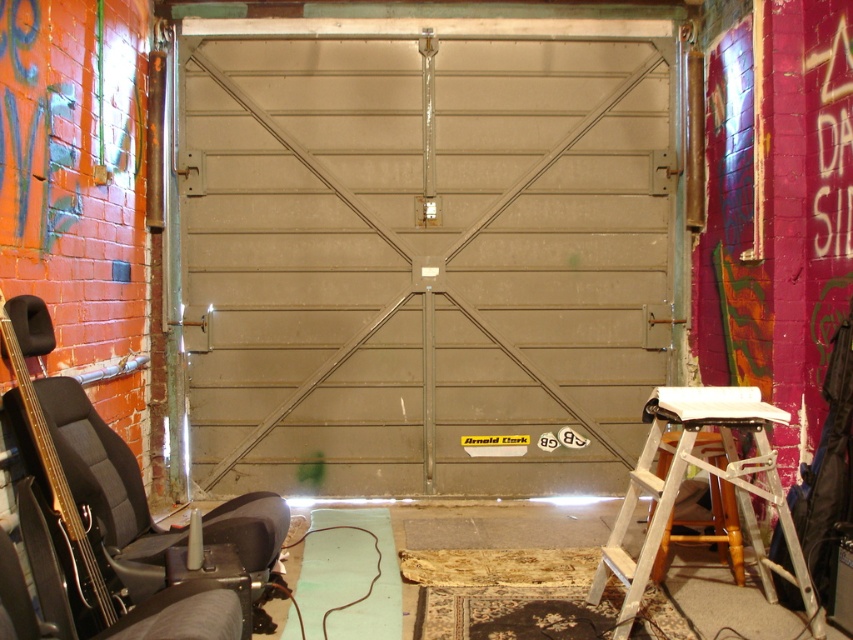
Can you confirm if white metallic ladder at lower right is taller than black leather chair at lower left?

Correct, white metallic ladder at lower right is much taller as black leather chair at lower left.

Is point (762, 410) behind point (223, 531)?

Yes, it is.

Does point (646, 490) come in front of point (267, 560)?

No, (646, 490) is further to viewer.

I want to click on white metallic ladder at lower right, so click(711, 477).

Who is more forward, (664, 259) or (54, 417)?

Positioned in front is point (54, 417).

Who is positioned more to the left, metallic gray garage door at center or black leather chair at lower left?

black leather chair at lower left

At what (x,y) coordinates should I click in order to perform the action: click on metallic gray garage door at center. Please return your answer as a coordinate pair (x, y). This screenshot has height=640, width=853. Looking at the image, I should click on (424, 260).

Image resolution: width=853 pixels, height=640 pixels. I want to click on metallic gray garage door at center, so click(424, 260).

Is the position of metallic gray garage door at center less distant than that of white metallic ladder at lower right?

That is False.

What do you see at coordinates (424, 260) in the screenshot?
I see `metallic gray garage door at center` at bounding box center [424, 260].

The height and width of the screenshot is (640, 853). What do you see at coordinates (424, 260) in the screenshot?
I see `metallic gray garage door at center` at bounding box center [424, 260].

I want to click on metallic gray garage door at center, so 424,260.